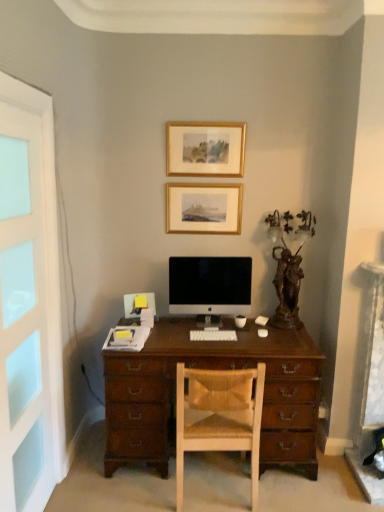
This screenshot has height=512, width=384. What do you see at coordinates (205, 149) in the screenshot? I see `gold/glossy picture frame at upper center, which is counted as the second picture frame, starting from the bottom` at bounding box center [205, 149].

What do you see at coordinates (204, 208) in the screenshot? The image size is (384, 512). I see `gold/glossy picture frame at upper center, which is counted as the second picture frame, starting from the top` at bounding box center [204, 208].

I want to click on white frosted glass screen door at left, so click(x=28, y=294).

This screenshot has width=384, height=512. Describe the element at coordinates (28, 294) in the screenshot. I see `white frosted glass screen door at left` at that location.

Locate an element on the screen. gold/glossy picture frame at upper center, which is counted as the second picture frame, starting from the bottom is located at coordinates (205, 149).

Which is more to the left, gold/glossy picture frame at upper center, which appears as the 1th picture frame when viewed from the top, or white frosted glass screen door at left?

Positioned to the left is white frosted glass screen door at left.

From a real-world perspective, is gold/glossy picture frame at upper center, which appears as the 1th picture frame when viewed from the top, beneath white frosted glass screen door at left?

No, from a real-world perspective, gold/glossy picture frame at upper center, which appears as the 1th picture frame when viewed from the top, is not below white frosted glass screen door at left.

From the image's perspective, relative to white frosted glass screen door at left, is gold/glossy picture frame at upper center, which is counted as the second picture frame, starting from the bottom, above or below?

Based on their image positions, gold/glossy picture frame at upper center, which is counted as the second picture frame, starting from the bottom, is located above white frosted glass screen door at left.

Is the position of wooden chair with woven cushion at center more distant than that of white plastic keyboard at center?

No, the depth of wooden chair with woven cushion at center is less than that of white plastic keyboard at center.

From a real-world perspective, between wooden chair with woven cushion at center and white plastic keyboard at center, who is vertically lower?

wooden chair with woven cushion at center.

Based on the photo, is wooden chair with woven cushion at center facing towards white plastic keyboard at center?

Yes.

Based on their sizes in the image, would you say wooden chair with woven cushion at center is bigger or smaller than white plastic keyboard at center?

wooden chair with woven cushion at center is bigger than white plastic keyboard at center.

Is the depth of wooden chair with woven cushion at center less than that of gold/glossy picture frame at upper center, which is counted as the second picture frame, starting from the bottom?

Yes, the depth of wooden chair with woven cushion at center is less than that of gold/glossy picture frame at upper center, which is counted as the second picture frame, starting from the bottom.

Consider the image. From a real-world perspective, which object stands above the other?

gold/glossy picture frame at upper center, which appears as the 1th picture frame when viewed from the top.

Considering the positions of points (194, 430) and (181, 153), is point (194, 430) farther from camera compared to point (181, 153)?

No, it is in front of (181, 153).

From the picture: From a real-world perspective, is wooden chair with woven cushion at center under white frosted glass screen door at left?

Yes, from a real-world perspective, wooden chair with woven cushion at center is below white frosted glass screen door at left.

From the image's perspective, is wooden chair with woven cushion at center on white frosted glass screen door at left?

Actually, wooden chair with woven cushion at center appears below white frosted glass screen door at left in the image.

Considering the positions of objects wooden chair with woven cushion at center and white frosted glass screen door at left in the image provided, who is more to the left, wooden chair with woven cushion at center or white frosted glass screen door at left?

From the viewer's perspective, white frosted glass screen door at left appears more on the left side.

Can white frosted glass screen door at left be found inside wooden chair with woven cushion at center?

No, white frosted glass screen door at left is not inside wooden chair with woven cushion at center.

Considering the sizes of objects gold/glossy picture frame at upper center, arranged as the 1th picture frame when ordered from the bottom, and satin black monitor at center in the image provided, who is bigger, gold/glossy picture frame at upper center, arranged as the 1th picture frame when ordered from the bottom, or satin black monitor at center?

satin black monitor at center is bigger.

Between point (240, 224) and point (203, 278), which one is positioned behind?

Point (240, 224)

Which picture frame is the 2nd one when counting from the back of the satin black monitor at center? Please provide its 2D coordinates.

[(204, 208)]

Relative to satin black monitor at center, is gold/glossy picture frame at upper center, which is counted as the second picture frame, starting from the top, in front or behind?

gold/glossy picture frame at upper center, which is counted as the second picture frame, starting from the top, is behind satin black monitor at center.

Is point (231, 130) positioned in front of point (208, 309)?

Yes.

In terms of width, does gold/glossy picture frame at upper center, which appears as the 1th picture frame when viewed from the top, look wider or thinner when compared to satin black monitor at center?

In the image, gold/glossy picture frame at upper center, which appears as the 1th picture frame when viewed from the top, appears to be more narrow than satin black monitor at center.

Considering the relative sizes of gold/glossy picture frame at upper center, which is counted as the second picture frame, starting from the bottom, and satin black monitor at center in the image provided, is gold/glossy picture frame at upper center, which is counted as the second picture frame, starting from the bottom, smaller than satin black monitor at center?

Yes.

Is gold/glossy picture frame at upper center, which is counted as the second picture frame, starting from the bottom, inside or outside of satin black monitor at center?

gold/glossy picture frame at upper center, which is counted as the second picture frame, starting from the bottom, is outside satin black monitor at center.

How many degrees apart are the facing directions of white plastic keyboard at center and white frosted glass screen door at left?

87.9 degrees.

Can you confirm if white plastic keyboard at center is wider than white frosted glass screen door at left?

Yes, white plastic keyboard at center is wider than white frosted glass screen door at left.

Which of these two, white plastic keyboard at center or white frosted glass screen door at left, is smaller?

white plastic keyboard at center.

Where is `the 1st picture frame behind when counting from the white frosted glass screen door at left`? The width and height of the screenshot is (384, 512). the 1st picture frame behind when counting from the white frosted glass screen door at left is located at coordinates (205, 149).

Identify the location of computer keyboard above the wooden chair with woven cushion at center (from the image's perspective). (213, 335).

Looking at this image, estimate the real-world distances between objects in this image. Which object is further from gold/glossy picture frame at upper center, arranged as the 1th picture frame when ordered from the bottom, gold/glossy picture frame at upper center, which appears as the 1th picture frame when viewed from the top, or wooden chair with woven cushion at center?

The object further to gold/glossy picture frame at upper center, arranged as the 1th picture frame when ordered from the bottom, is wooden chair with woven cushion at center.

Which object lies further to the anchor point gold/glossy picture frame at upper center, arranged as the 1th picture frame when ordered from the bottom, gold/glossy picture frame at upper center, which is counted as the second picture frame, starting from the bottom, or satin black monitor at center?

satin black monitor at center is further to gold/glossy picture frame at upper center, arranged as the 1th picture frame when ordered from the bottom.

Estimate the real-world distances between objects in this image. Which object is closer to satin black monitor at center, gold/glossy picture frame at upper center, which is counted as the second picture frame, starting from the bottom, or wooden chair with woven cushion at center?

Based on the image, gold/glossy picture frame at upper center, which is counted as the second picture frame, starting from the bottom, appears to be nearer to satin black monitor at center.

Based on their spatial positions, is gold/glossy picture frame at upper center, which is counted as the second picture frame, starting from the top, or gold/glossy picture frame at upper center, which appears as the 1th picture frame when viewed from the top, closer to satin black monitor at center?

The object closer to satin black monitor at center is gold/glossy picture frame at upper center, which is counted as the second picture frame, starting from the top.

Considering their positions, is white plastic keyboard at center positioned further to satin black monitor at center than gold/glossy picture frame at upper center, arranged as the 1th picture frame when ordered from the bottom?

gold/glossy picture frame at upper center, arranged as the 1th picture frame when ordered from the bottom, is positioned further to the anchor satin black monitor at center.

Based on their spatial positions, is gold/glossy picture frame at upper center, which appears as the 1th picture frame when viewed from the top, or white plastic keyboard at center further from white frosted glass screen door at left?

Based on the image, gold/glossy picture frame at upper center, which appears as the 1th picture frame when viewed from the top, appears to be further to white frosted glass screen door at left.

Which object lies further to the anchor point white frosted glass screen door at left, wooden chair with woven cushion at center or gold/glossy picture frame at upper center, which is counted as the second picture frame, starting from the top?

Among the two, gold/glossy picture frame at upper center, which is counted as the second picture frame, starting from the top, is located further to white frosted glass screen door at left.

Estimate the real-world distances between objects in this image. Which object is closer to satin black monitor at center, gold/glossy picture frame at upper center, which appears as the 1th picture frame when viewed from the top, or white frosted glass screen door at left?

Among the two, gold/glossy picture frame at upper center, which appears as the 1th picture frame when viewed from the top, is located nearer to satin black monitor at center.

Locate an element on the screen. The height and width of the screenshot is (512, 384). chair positioned between white frosted glass screen door at left and gold/glossy picture frame at upper center, arranged as the 1th picture frame when ordered from the bottom, from near to far is located at coordinates (218, 416).

Image resolution: width=384 pixels, height=512 pixels. Identify the location of screen door between gold/glossy picture frame at upper center, which is counted as the second picture frame, starting from the bottom, and wooden chair with woven cushion at center in the up-down direction. (28, 294).

You are a GUI agent. You are given a task and a screenshot of the screen. Output one action in this format:
    pyautogui.click(x=<x>, y=<y>)
    Task: Click on the computer keyboard located between white frosted glass screen door at left and gold/glossy picture frame at upper center, which is counted as the second picture frame, starting from the bottom, in the depth direction
    
    Given the screenshot: What is the action you would take?
    pyautogui.click(x=213, y=335)

The height and width of the screenshot is (512, 384). I want to click on computer keyboard between white frosted glass screen door at left and gold/glossy picture frame at upper center, which is counted as the second picture frame, starting from the top, along the z-axis, so click(213, 335).